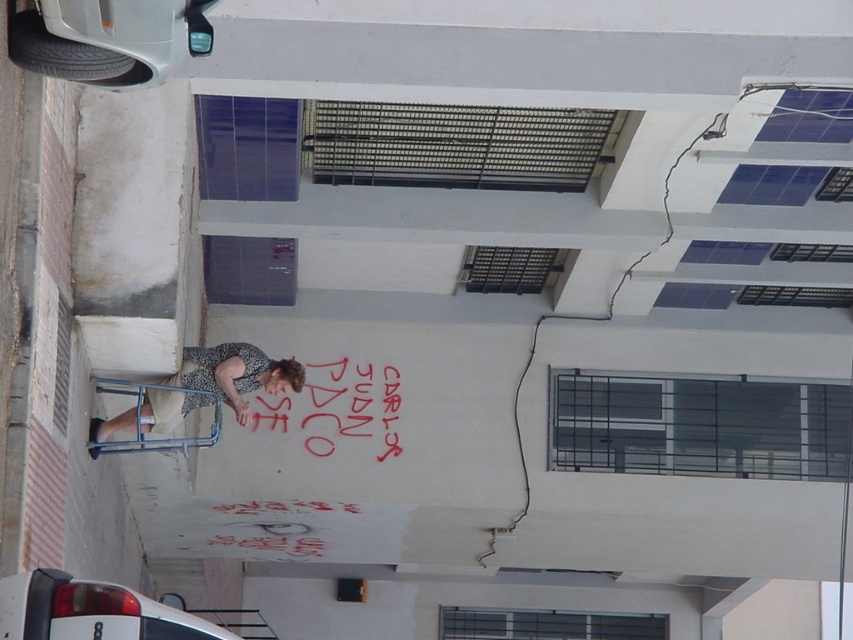
Question: Which point is farther from the camera taking this photo?

Choices:
 (A) (259, 388)
 (B) (389, 438)

Answer: (B)

Question: Is beige fabric dress at lower left in front of red chalk graffiti at center?

Choices:
 (A) yes
 (B) no

Answer: (A)

Question: Is beige fabric dress at lower left below red chalk graffiti at center?

Choices:
 (A) yes
 (B) no

Answer: (B)

Question: Which point appears farthest from the camera in this image?

Choices:
 (A) (381, 433)
 (B) (299, 378)

Answer: (A)

Question: Does beige fabric dress at lower left have a larger size compared to red chalk graffiti at center?

Choices:
 (A) no
 (B) yes

Answer: (B)